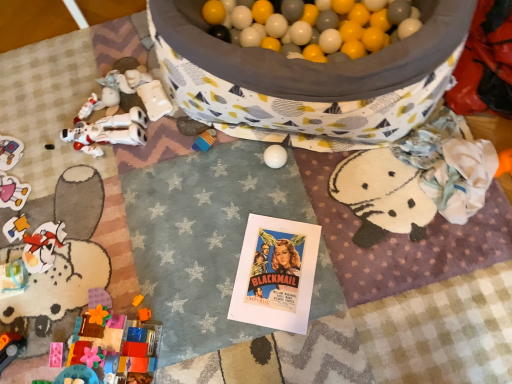
Locate an element on the screen. The image size is (512, 384). vacant space to the right of plastic toy car at lower left, which is counted as the 2th toy, starting from the top is located at coordinates (48, 145).